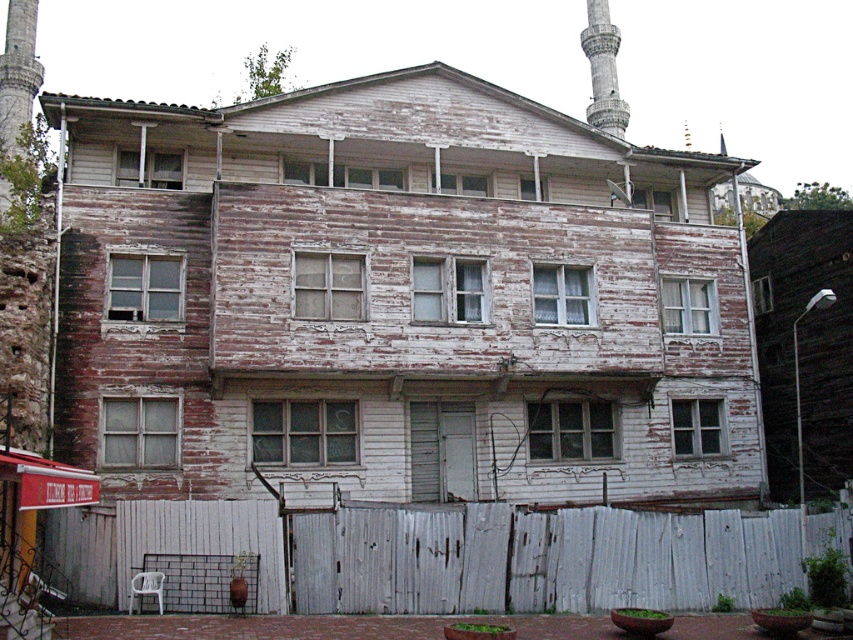
You are standing at the entrance of the old wooden building and want to place a new bench exactly at the same position as the white wooden fence at lower center. What coordinates should you use for placement?

The coordinates for the white wooden fence at lower center are at point (538, 557), so you should place the bench at those coordinates.

You are a visitor standing at the entrance of the old wooden building. You see the white wooden fence at lower center and the gray stone minaret at upper right. Which object is closer to you?

The white wooden fence at lower center is closer to you because it is in front of the gray stone minaret at upper right.

You are standing in front of the old wooden building and want to take a photo of the white wooden fence at lower center and the gray stone minaret at upper right. Which object should you focus on first if you want to capture both in a single frame without moving the camera?

You should focus on the gray stone minaret at upper right first because it is larger than the white wooden fence at lower center, allowing both to fit within the frame more effectively.